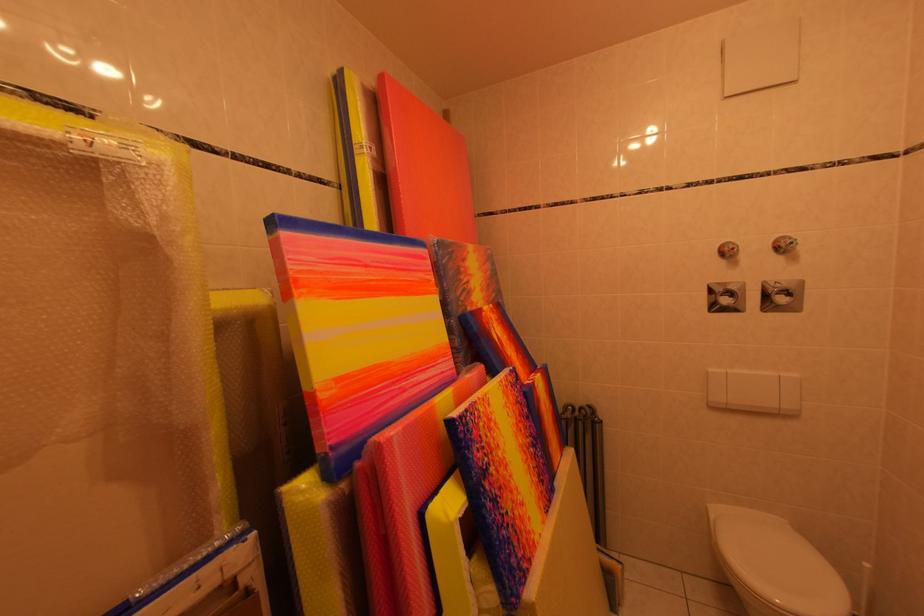
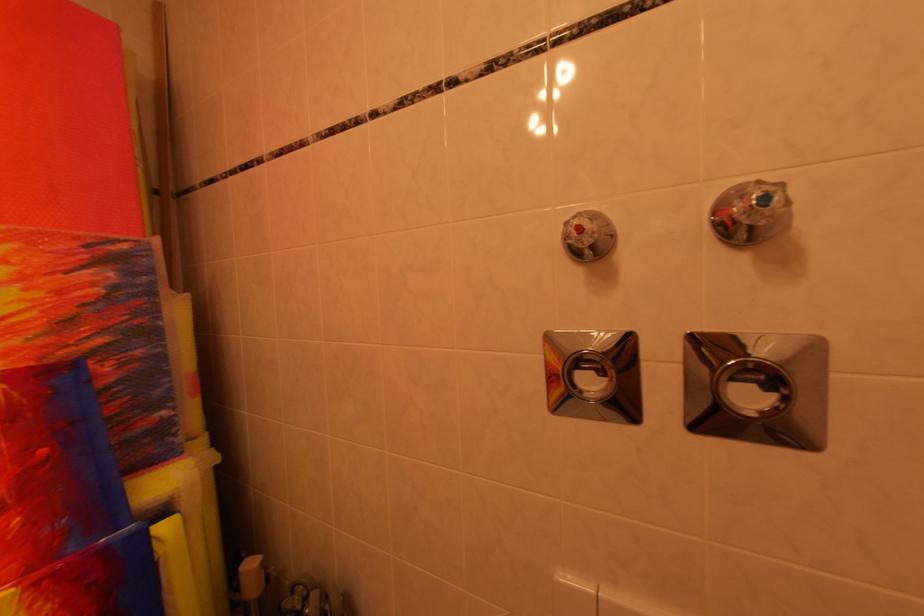
The images are taken continuously from a first-person perspective. In which direction are you moving?

The cameraman moved toward right, forward.